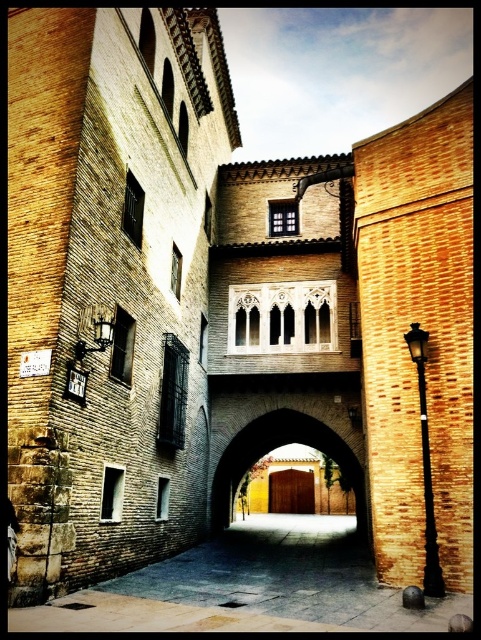
In the scene shown: Can you confirm if smooth stone alley at center is positioned to the left of brown wooden door at center?

Yes, smooth stone alley at center is to the left of brown wooden door at center.

Can you confirm if smooth stone alley at center is wider than brown wooden door at center?

Indeed, smooth stone alley at center has a greater width compared to brown wooden door at center.

Between point (188, 604) and point (239, 468), which one is positioned behind?

The point (239, 468) is behind.

Where is `smooth stone alley at center`? Image resolution: width=481 pixels, height=640 pixels. smooth stone alley at center is located at coordinates (249, 588).